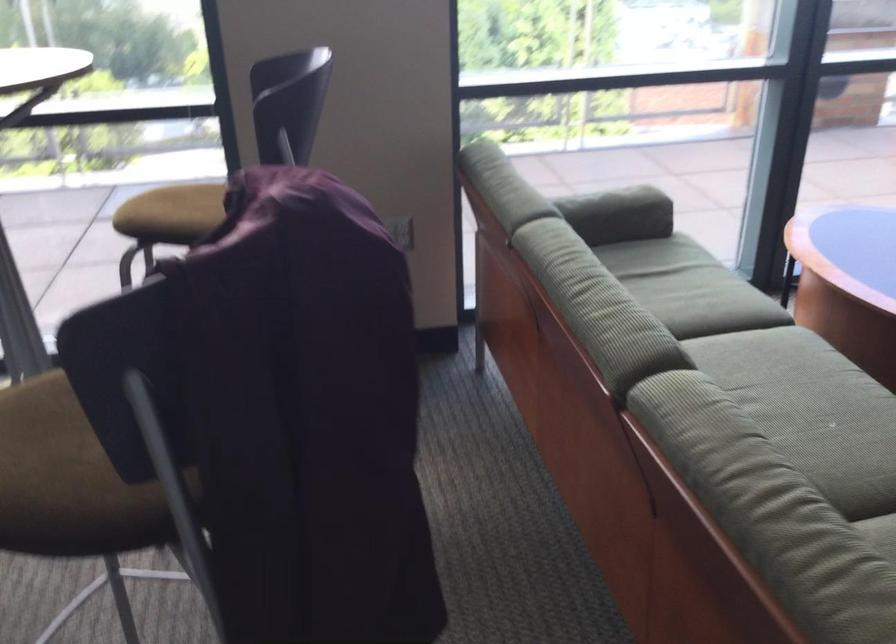
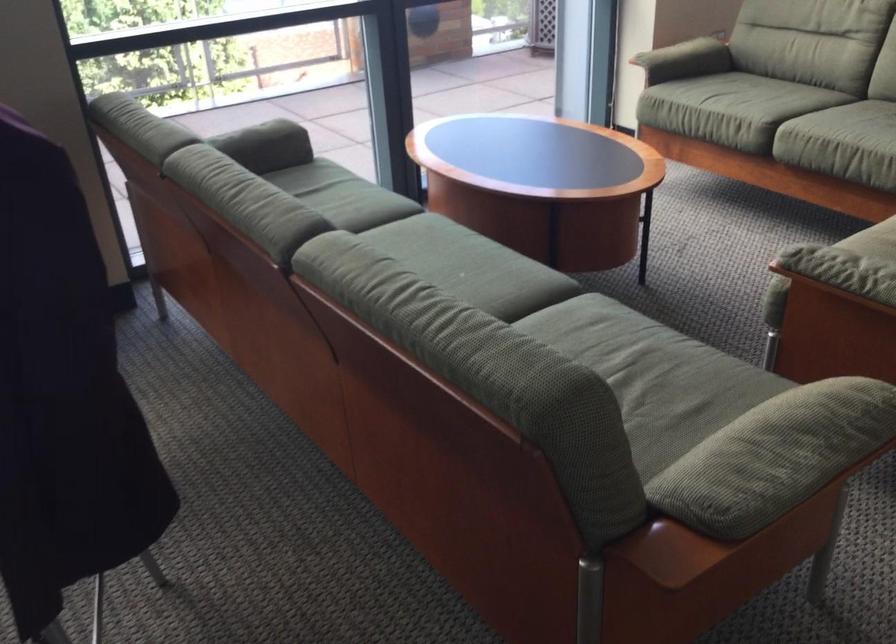
Where in the second image is the point corresponding to (x=798, y=402) from the first image?

(442, 267)